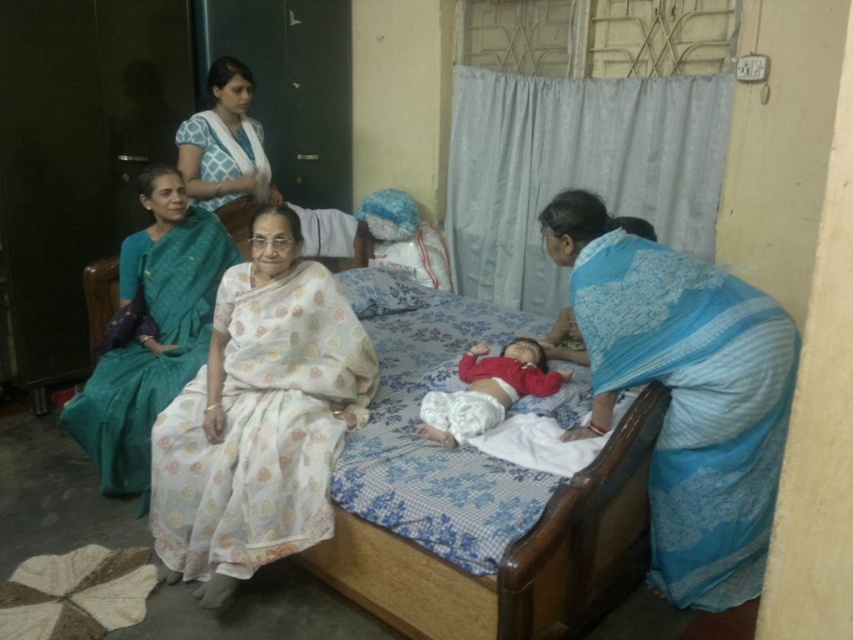
You are an interior designer assessing the room layout. The blue floral saree at right and the white printed saree at upper center are both displayed in the room. Which of these two sarees occupies more horizontal space in the scene?

The blue floral saree at right has a greater width than the white printed saree at upper center, so it occupies more horizontal space in the scene.

You are a photographer in the room and want to take a picture of the white floral saree at center and the white printed saree at upper center. To ensure both are in the frame, should you position yourself to the left or right of the bed?

You should position yourself to the right of the bed because the white floral saree at center is to the right of the white printed saree at upper center, so placing yourself on the right side will keep both within the camera frame.

You are a tailor measuring the width of fabrics for a client. You have two sarees in front of you, the teal silk saree at left and the white printed saree at upper center. Which saree has a greater width?

The teal silk saree at left has a greater width than the white printed saree at upper center.